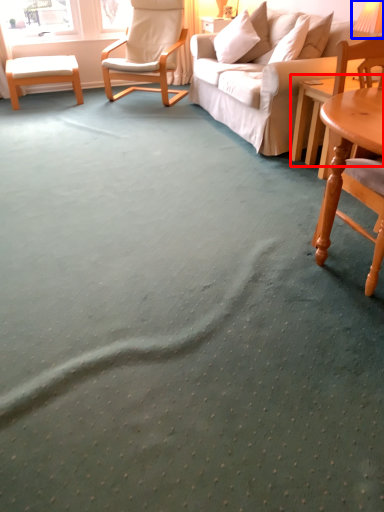
Question: Which object is further to the camera taking this photo, coffee table (highlighted by a red box) or table lamp (highlighted by a blue box)?

Choices:
 (A) coffee table
 (B) table lamp

Answer: (A)